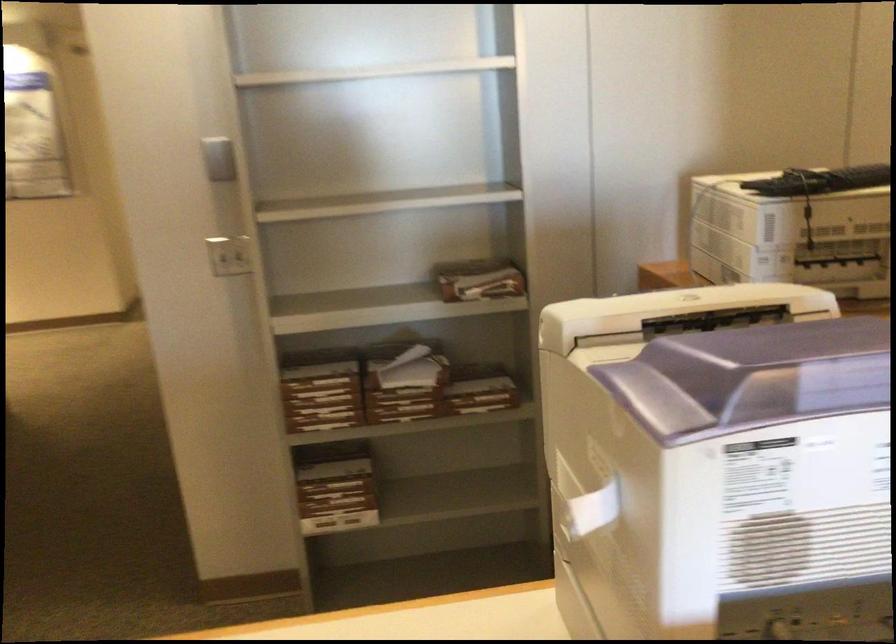
What do you see at coordinates (592, 507) in the screenshot?
I see `the white printer handle` at bounding box center [592, 507].